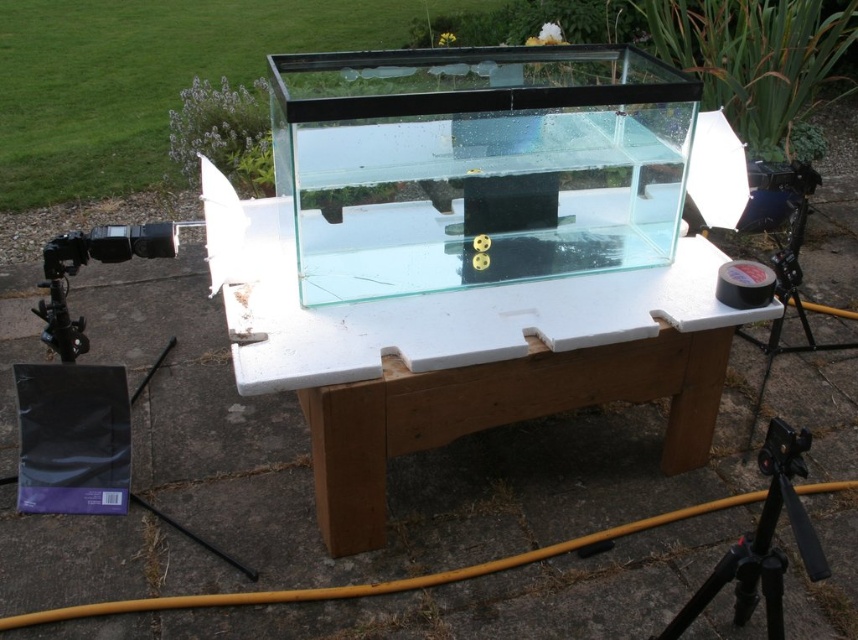
You are setting up a photography setup and need to place a camera tripod. The scene has a transparent plastic table at center and a black rubber tape at right. According to the description, where should you place the tripod relative to these objects to ensure it doesn not interfere with the table?

The transparent plastic table at center is to the left of the black rubber tape at right, so placing the tripod to the right of the black rubber tape at right would keep it away from the table.

You are standing at the edge of the paved area looking at the rectangular glass aquarium on the wooden table. There is a point labeled as point (482, 369). Based on the scene description, what object does this point most likely correspond to?

The point (482, 369) corresponds to the transparent plastic table at center as indicated in the Objects Description.

You are setting up a small decoration on the table where the rectangular glass aquarium is placed. The decoration requires placing it exactly at the point marked by the coordinates point [482,369]. Based on the scene description, where should you place the decoration?

The point [482,369] marks the transparent plastic table at center, so you should place the decoration on the transparent plastic table at center.